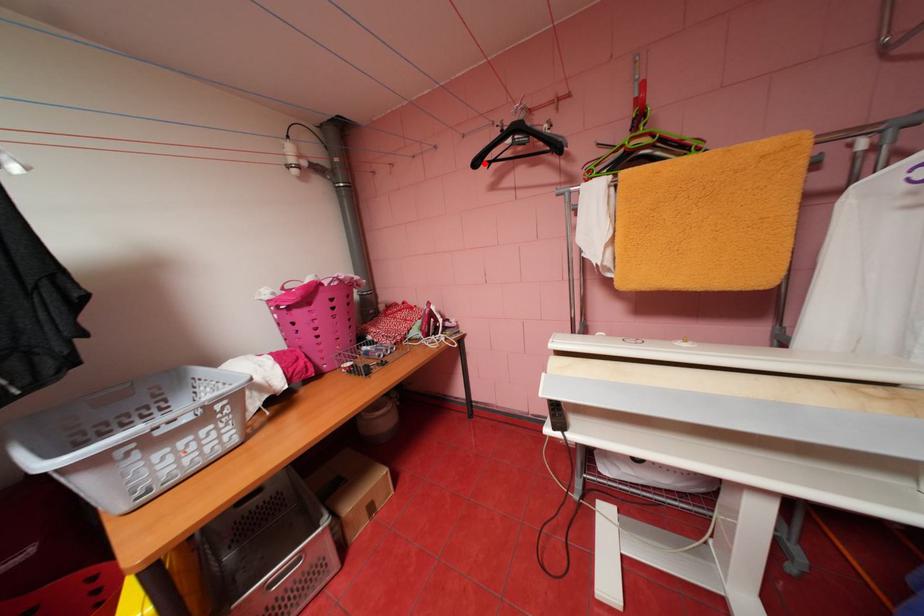
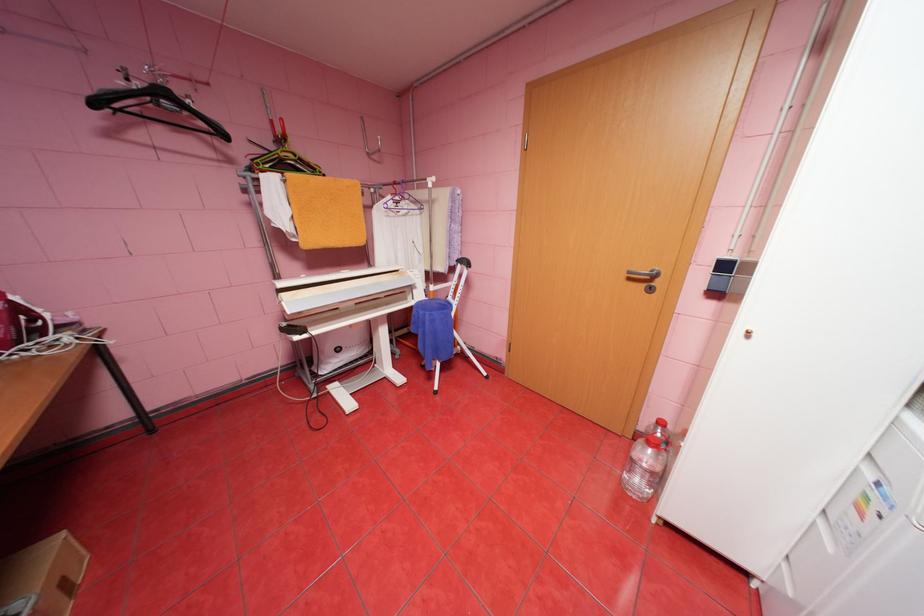
Question: I am providing you with two images of the same scene from different viewpoints. A red point is shown in image1. For the corresponding object point in image2, is it positioned nearer or farther from the camera?

Choices:
 (A) Nearer
 (B) Farther

Answer: (B)